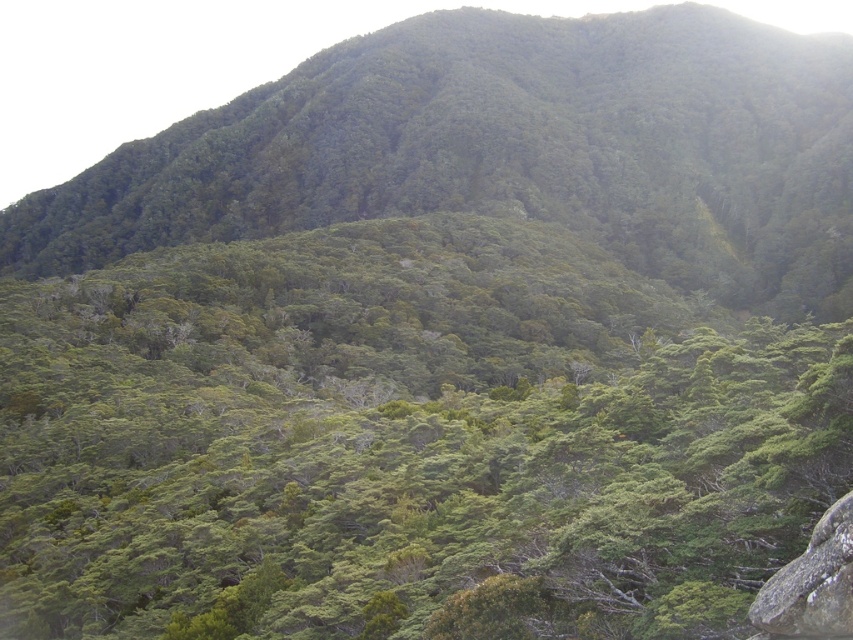
You are a hiker who wants to reach the gray rough rock at lower right. From your current position, which direction should you move relative to the green leafy tree at center?

You should move to the right of the green leafy tree at center since the gray rough rock at lower right is positioned on the right side of it.

You are standing in the mountain landscape and want to determine the relative positions of two points. Which point is closer to you, point (537, 419) or point (456, 150)?

Point (537, 419) is closer to the viewer than point (456, 150).

You are a hiker standing at the base of the mountain. You see a green leafy tree at center and a gray rough rock at lower right. Which object is closer to you?

The gray rough rock at lower right is closer to you since it is located at the lower right of the scene, which is typically nearer in such landscapes, while the green leafy tree at center is positioned further away in the middle ground.